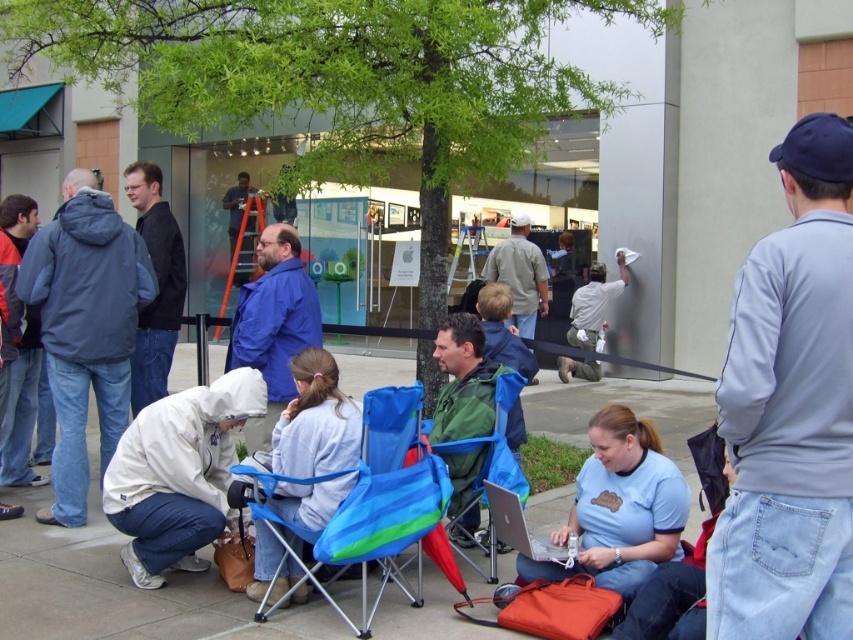
Question: Which point is closer to the camera taking this photo?

Choices:
 (A) (573, 541)
 (B) (10, 406)
 (C) (161, 333)

Answer: (A)

Question: Does gray sweatshirt at upper right come in front of green matte jacket at center?

Choices:
 (A) yes
 (B) no

Answer: (A)

Question: Where is blue fabric chair at center located in relation to green matte jacket at center in the image?

Choices:
 (A) below
 (B) above

Answer: (A)

Question: Which point is closer to the camera taking this photo?

Choices:
 (A) (469, 493)
 (B) (515, 241)
 (C) (1, 205)
 (D) (466, 476)

Answer: (D)

Question: Is gray sweatshirt at upper right closer to the viewer compared to green matte jacket at center?

Choices:
 (A) yes
 (B) no

Answer: (A)

Question: Which point is closer to the camera?

Choices:
 (A) blue matte jacket at center
 (B) blue fabric chair at center

Answer: (B)